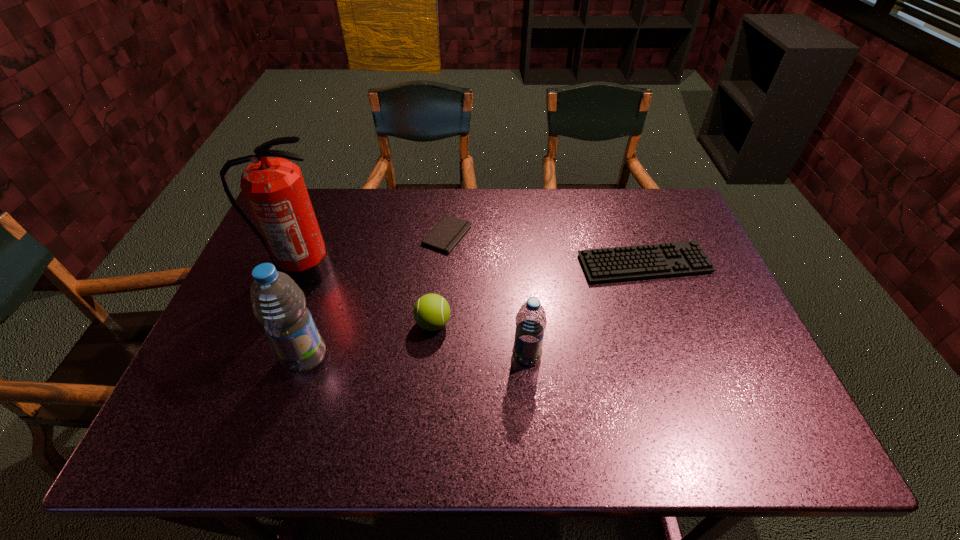
This screenshot has width=960, height=540. Identify the location of the taller water bottle. tap(278, 303).

What are the coordinates of `the left water bottle` in the screenshot? It's located at (278, 303).

This screenshot has width=960, height=540. Identify the location of the shorter water bottle. (531, 321).

You are a GUI agent. You are given a task and a screenshot of the screen. Output one action in this format:
    pyautogui.click(x=<x>, y=<y>)
    Task: Click on the third tallest object
    The height and width of the screenshot is (540, 960).
    Given the screenshot: What is the action you would take?
    pyautogui.click(x=531, y=321)

Find the location of a particular element. the shortest object is located at coordinates (449, 231).

Locate an element on the screen. Image resolution: width=960 pixels, height=540 pixels. tennis ball is located at coordinates pyautogui.click(x=431, y=312).

You are a GUI agent. You are given a task and a screenshot of the screen. Output one action in this format:
    pyautogui.click(x=<x>, y=<y>)
    Task: Click on the third nearest object
    The height and width of the screenshot is (540, 960).
    Given the screenshot: What is the action you would take?
    (x=431, y=312)

This screenshot has height=540, width=960. In order to click on the rightmost object in this screenshot , I will do `click(679, 258)`.

The height and width of the screenshot is (540, 960). Identify the location of computer keyboard. [679, 258].

This screenshot has width=960, height=540. What are the coordinates of `the tallest object` in the screenshot? It's located at (274, 188).